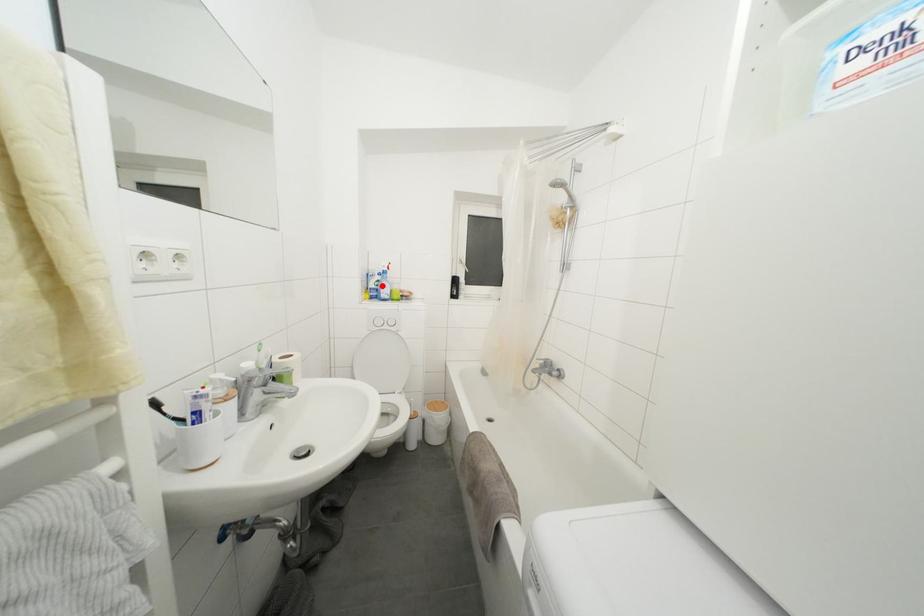
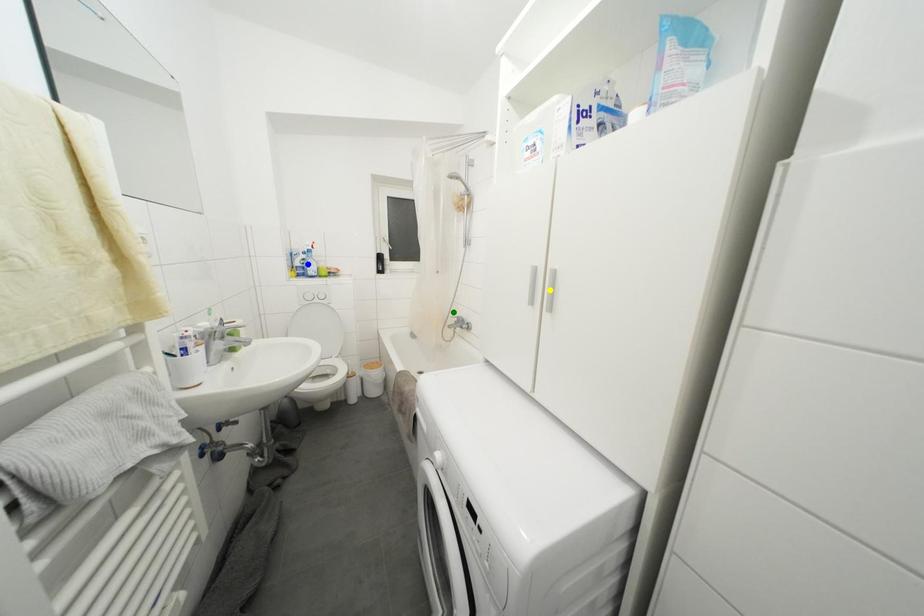
Question: I am providing you with two images of the same scene from different viewpoints. A red point is marked on the first image. You are given multiple points on the second image. Which mark in image 2 goes with the point in image 1?

Choices:
 (A) blue point
 (B) yellow point
 (C) green point

Answer: (A)